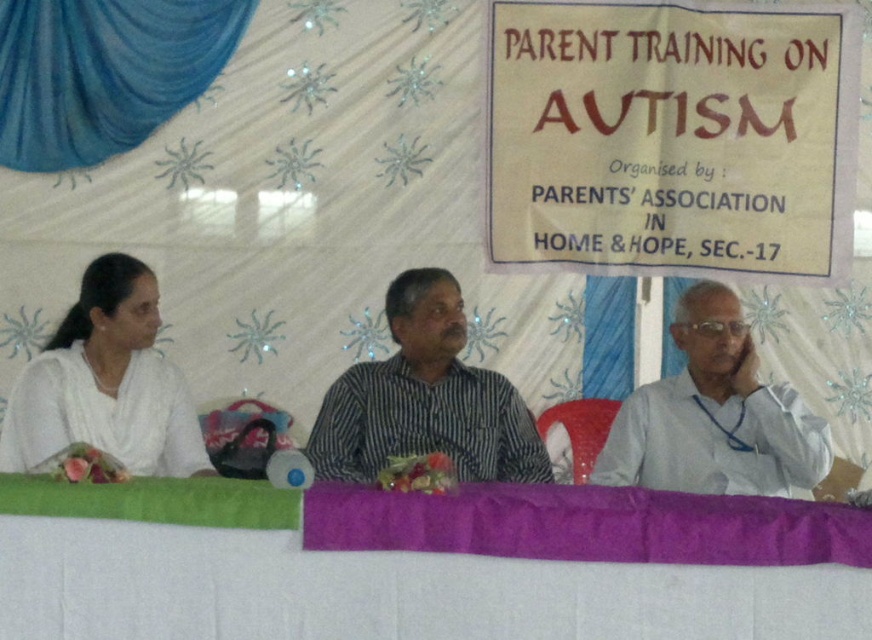
You are a GUI agent. You are given a task and a screenshot of the screen. Output one action in this format:
    pyautogui.click(x=<x>, y=<y>)
    Task: Click on the purple fabric tablecloth at lower center
    
    Given the screenshot: What is the action you would take?
    pyautogui.click(x=421, y=566)

Which is in front, point (850, 561) or point (462, 404)?

Point (850, 561) is more forward.

What do you see at coordinates (421, 566) in the screenshot?
I see `purple fabric tablecloth at lower center` at bounding box center [421, 566].

You are a GUI agent. You are given a task and a screenshot of the screen. Output one action in this format:
    pyautogui.click(x=<x>, y=<y>)
    Task: Click on the purple fabric tablecloth at lower center
    Image resolution: width=872 pixels, height=640 pixels.
    Given the screenshot: What is the action you would take?
    pyautogui.click(x=421, y=566)

Does white paper banner at upper center appear on the right side of white shirt at right?

Correct, you'll find white paper banner at upper center to the right of white shirt at right.

Is point (707, 227) closer to camera compared to point (625, 452)?

No, it is behind (625, 452).

Identify the location of white paper banner at upper center. Image resolution: width=872 pixels, height=640 pixels. (670, 136).

Is white shirt at right to the left of white satin saree at left from the viewer's perspective?

No, white shirt at right is not to the left of white satin saree at left.

Is white shirt at right bigger than white satin saree at left?

No.

At what (x,y) coordinates should I click in order to perform the action: click on white shirt at right. Please return your answer as a coordinate pair (x, y). The width and height of the screenshot is (872, 640). Looking at the image, I should click on (714, 416).